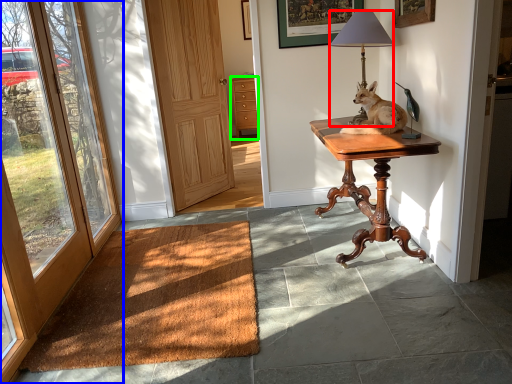
Question: Considering the real-world distances, which object is closest to lamp (highlighted by a red box)? door (highlighted by a blue box) or cabinetry (highlighted by a green box).

Choices:
 (A) door
 (B) cabinetry

Answer: (A)